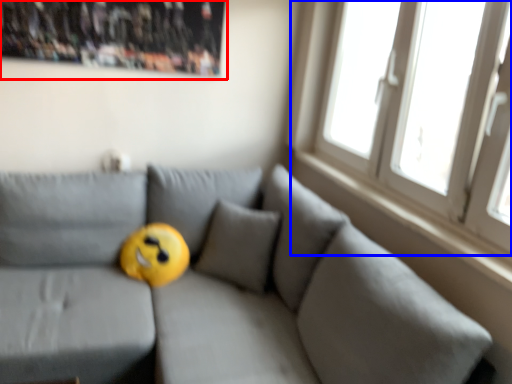
Question: Among these objects, which one is farthest to the camera, bulletin board (highlighted by a red box) or window (highlighted by a blue box)?

Choices:
 (A) bulletin board
 (B) window

Answer: (A)